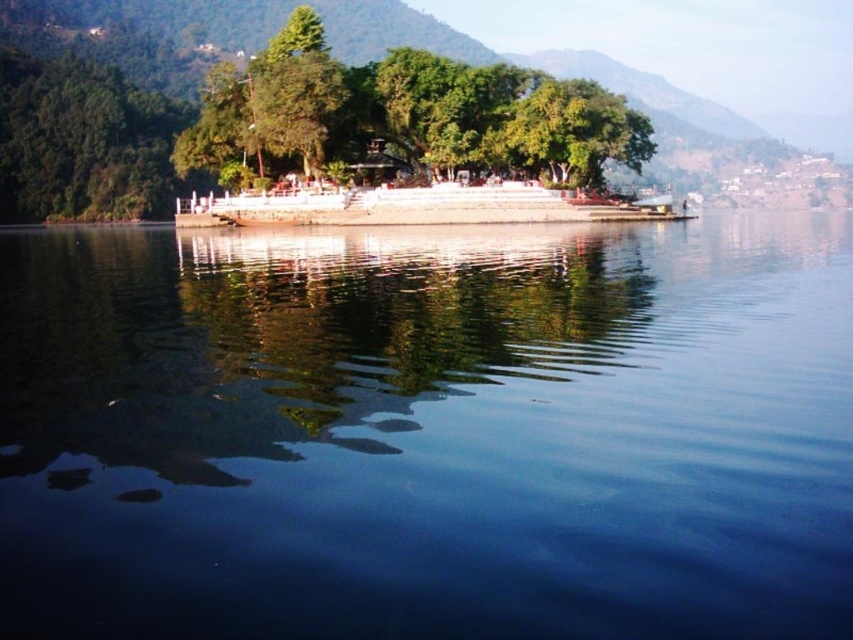
You are standing at the edge of the lake and see the point marked as point (428, 429). What is the location of this point relative to the transparent blue water at center?

The point (428, 429) is the location of the transparent blue water at center.

You are standing at the lakeside and want to take a photo of the green leafy tree at center and the transparent blue water at center. Which object will appear larger in your camera viewfinder?

The transparent blue water at center will appear larger in the camera viewfinder because it is closer to the viewer than the green leafy tree at center.

You are standing at the lakeside and want to determine which of the two points, point (445,394) or point (352,80), is closer to you. Based on the scene, can you tell which one is nearer?

Point (445,394) is closer to the viewer than point (352,80).